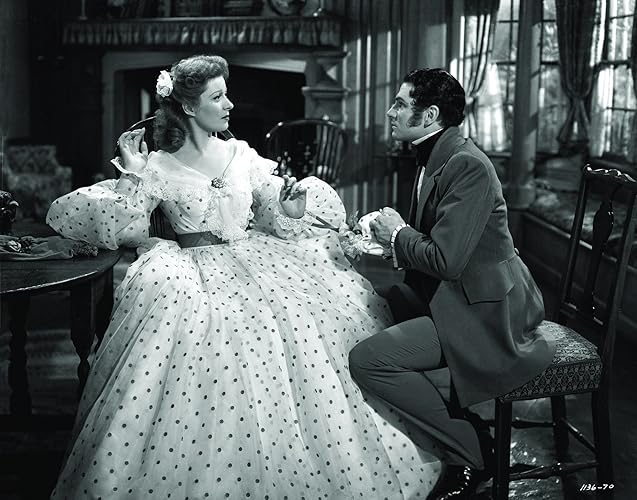
At what (x,y) coordinates should I click in order to perform the action: click on table. Please return your answer as a coordinate pair (x, y). Image resolution: width=637 pixels, height=500 pixels. Looking at the image, I should click on (38, 273).